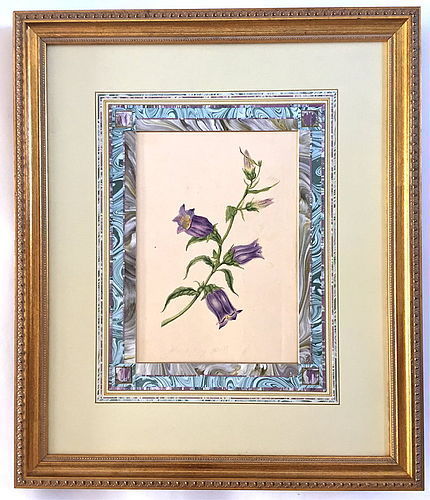
In order to click on tan mat in picture frame in this screenshot , I will do `click(78, 207)`.